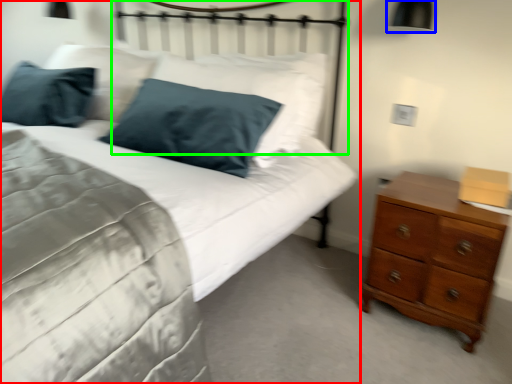
Question: Estimate the real-world distances between objects in this image. Which object is closer to bed (highlighted by a red box), bedside lamp (highlighted by a blue box) or headboard (highlighted by a green box)?

Choices:
 (A) bedside lamp
 (B) headboard

Answer: (B)